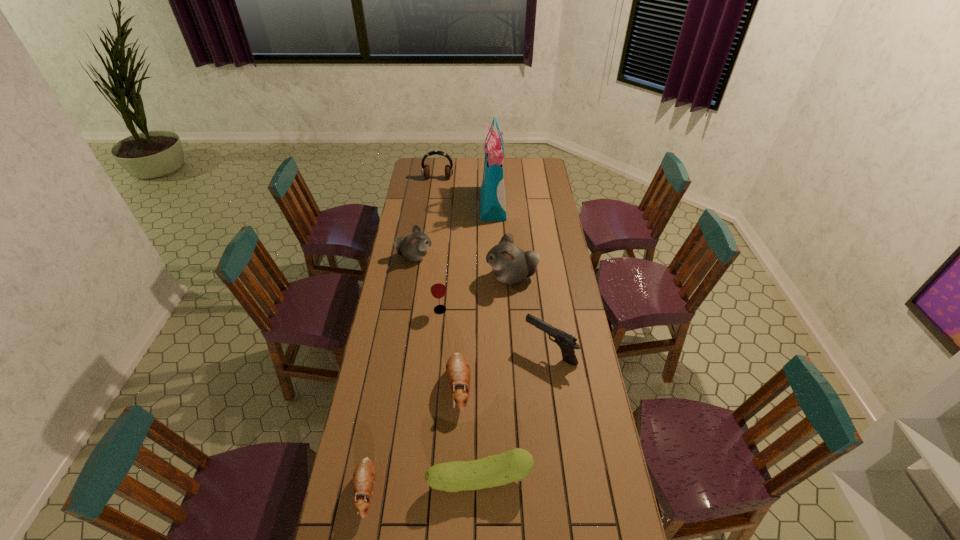
Where is `empty location between the left white hamster and the bigger white hamster`? This screenshot has height=540, width=960. empty location between the left white hamster and the bigger white hamster is located at coordinates (463, 267).

The width and height of the screenshot is (960, 540). Identify the location of vacant point located between the bigger brown hamster and the left white hamster. (437, 322).

Locate an element on the screen. unoccupied position between the red glass and the shopping bag is located at coordinates (467, 257).

Locate which object ranks second in proximity to the green cucumber. Please provide its 2D coordinates. Your answer should be formatted as a tuple, i.e. [(x, y)], where the tuple contains the x and y coordinates of a point satisfying the conditions above.

[(458, 374)]

Identify the location of object that can be found as the sixth closest to the second hamster from right to left. (414, 247).

Identify which hamster is the second nearest to the tallest object. Please provide its 2D coordinates. Your answer should be formatted as a tuple, i.e. [(x, y)], where the tuple contains the x and y coordinates of a point satisfying the conditions above.

[(510, 264)]

Locate an element on the screen. the second closest hamster relative to the right white hamster is located at coordinates (458, 374).

The height and width of the screenshot is (540, 960). I want to click on blank space that satisfies the following two spatial constraints: 1. on the face of the rightmost hamster; 2. at the face of the shortest hamster, so click(527, 490).

Identify the location of vacant region that satisfies the following two spatial constraints: 1. on the face of the right white hamster; 2. at the face of the smaller brown hamster. The width and height of the screenshot is (960, 540). (527, 490).

Locate an element on the screen. The height and width of the screenshot is (540, 960). free space in the image that satisfies the following two spatial constraints: 1. on the face of the tallest hamster; 2. at the face of the shortest hamster is located at coordinates pyautogui.click(x=527, y=490).